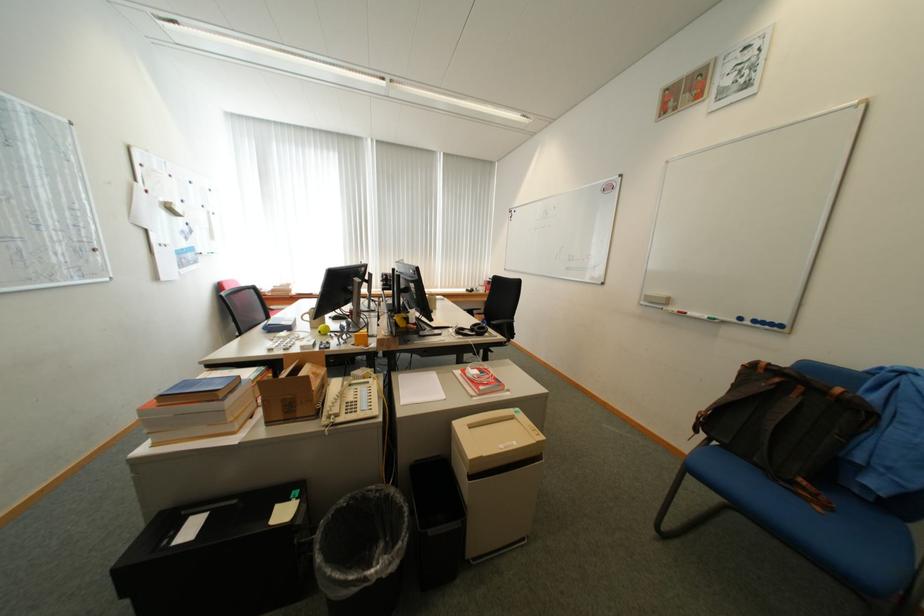
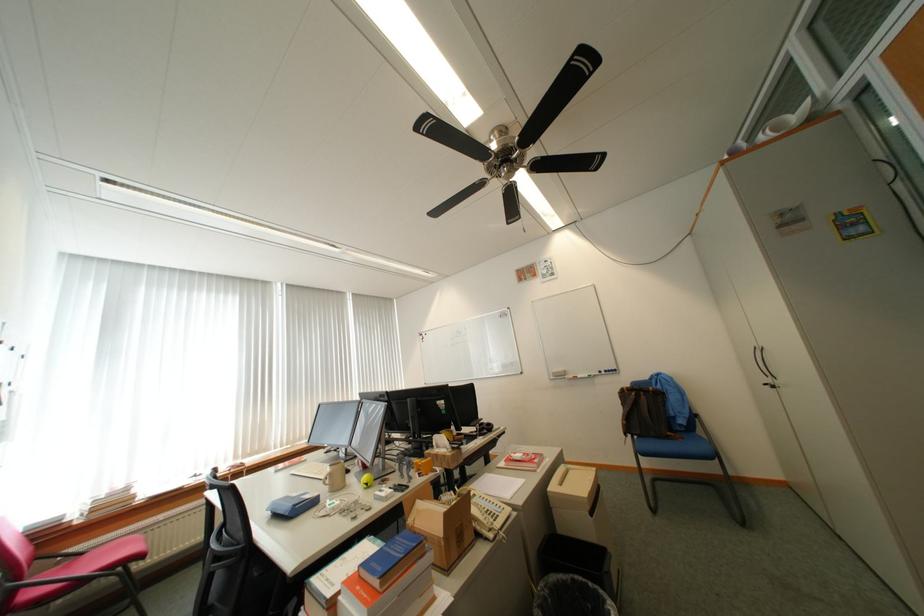
Locate, in the second image, the point that corresponds to point (718, 440) in the first image.

(641, 438)